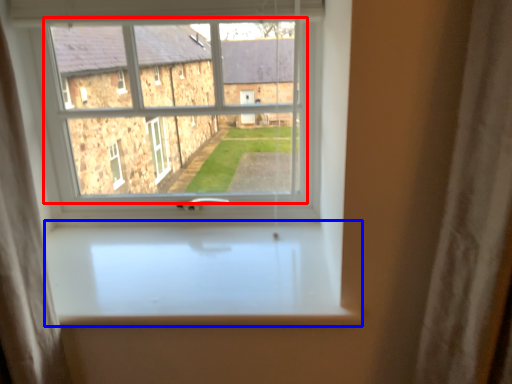
Question: Which point is closer to the camera, bay window (highlighted by a red box) or window sill (highlighted by a blue box)?

Choices:
 (A) bay window
 (B) window sill

Answer: (B)